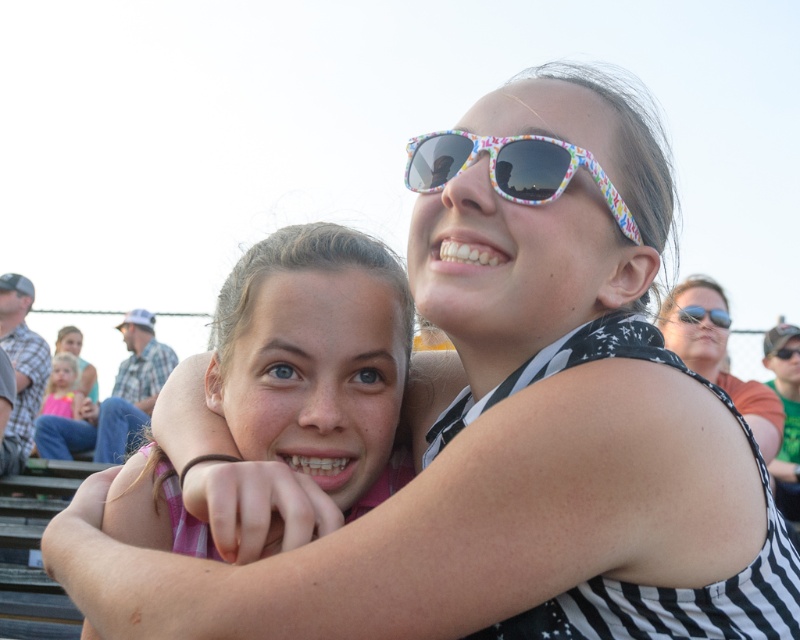
Can you confirm if black and white striped shirt at upper right is positioned to the left of multicolored plastic sunglasses at upper right?

Indeed, black and white striped shirt at upper right is positioned on the left side of multicolored plastic sunglasses at upper right.

Does black and white striped shirt at upper right have a lesser width compared to multicolored plastic sunglasses at upper right?

Incorrect, black and white striped shirt at upper right's width is not less than multicolored plastic sunglasses at upper right's.

Describe the element at coordinates (717, 355) in the screenshot. Image resolution: width=800 pixels, height=640 pixels. I see `black and white striped shirt at upper right` at that location.

The width and height of the screenshot is (800, 640). Identify the location of black and white striped shirt at upper right. (717, 355).

Does multicolored plastic sunglasses at upper right appear on the left side of matte black sunglasses at upper center?

Yes, multicolored plastic sunglasses at upper right is to the left of matte black sunglasses at upper center.

Does multicolored plastic sunglasses at upper right have a lesser height compared to matte black sunglasses at upper center?

No.

This screenshot has height=640, width=800. In order to click on multicolored plastic sunglasses at upper right in this screenshot , I will do `click(704, 316)`.

Identify the location of multicolored plastic sunglasses at upper right. (704, 316).

Is point (494, 157) positioned after point (720, 321)?

No, (494, 157) is closer to viewer.

Who is shorter, colorful plastic sunglasses at upper center or multicolored plastic sunglasses at upper right?

multicolored plastic sunglasses at upper right is shorter.

This screenshot has width=800, height=640. What are the coordinates of `colorful plastic sunglasses at upper center` in the screenshot? It's located at [510, 168].